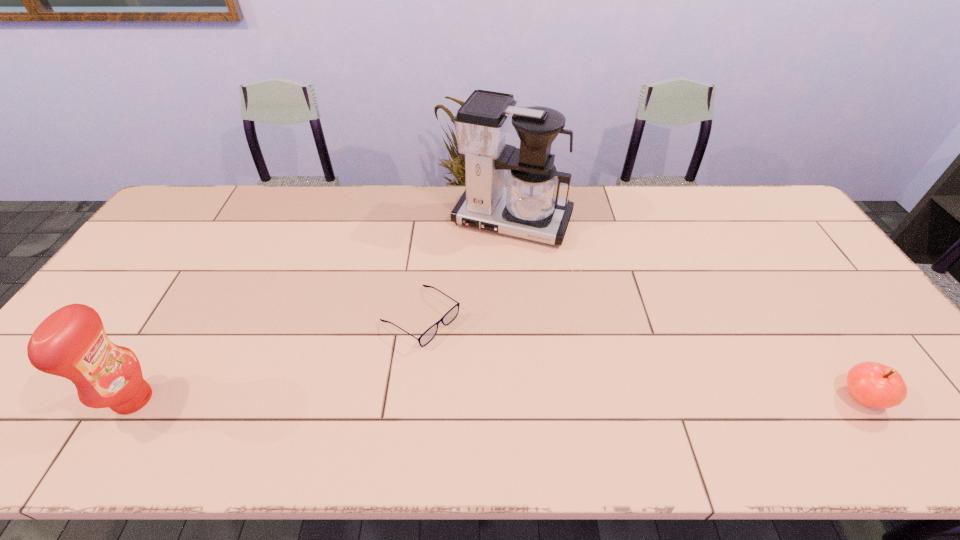
Locate an element on the screen. Image resolution: width=960 pixels, height=540 pixels. free space located 0.290m on the front-facing side of the third nearest object is located at coordinates (543, 402).

The image size is (960, 540). I want to click on free point located 0.100m on the front-facing side of the third nearest object, so click(x=480, y=359).

At what (x,y) coordinates should I click in order to perform the action: click on vacant space situated 0.080m on the front-facing side of the third nearest object. Please return your answer as a coordinate pair (x, y). The image size is (960, 540). Looking at the image, I should click on (474, 354).

The height and width of the screenshot is (540, 960). In order to click on vacant space located at the front of the farthest object where the controls are located in this screenshot , I will do `click(468, 302)`.

In order to click on vacant space located at the front of the farthest object where the controls are located in this screenshot , I will do `click(479, 280)`.

Identify the location of free location located at the front of the farthest object where the controls are located. Image resolution: width=960 pixels, height=540 pixels. (466, 307).

Find the location of a particular element. This screenshot has width=960, height=540. object that is positioned at the far edge is located at coordinates (529, 207).

You are a GUI agent. You are given a task and a screenshot of the screen. Output one action in this format:
    pyautogui.click(x=<x>, y=<y>)
    Task: Click on the condiment positioned at the near edge
    
    Given the screenshot: What is the action you would take?
    pyautogui.click(x=71, y=342)

Find the location of a particular element. apple present at the near edge is located at coordinates (872, 384).

The width and height of the screenshot is (960, 540). What are the coordinates of `object that is at the right edge` in the screenshot? It's located at (872, 384).